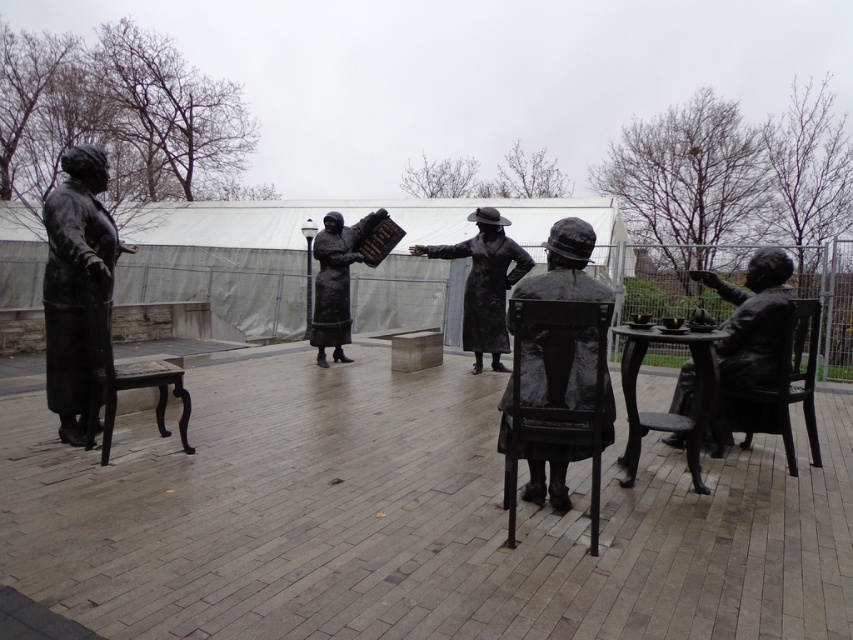
You are a photographer trying to capture both the shiny black coat at center and the bronze statue of woman holding book at center in the same frame. Based on their positions, which object should you adjust your camera angle to focus on first to include both?

The shiny black coat at center is positioned on the right side of bronze statue of woman holding book at center. To include both in the frame, you should first focus on the bronze statue of woman holding book at center and then adjust the angle to include the shiny black coat at center on its right side.

You are a visitor at the park and want to sit on one of the chairs. The black metal chair at center is lower than the black polished wood chair at left. Which chair would you choose if you prefer a seat that is closer to the ground?

The black metal chair at center is not as tall as the black polished wood chair at left, so if you prefer a seat closer to the ground, you should choose the black metal chair at center.

You are a tour guide leading a group through the park. You want to point out both the shiny black coat at center and the bronze statue of woman holding book at center to your group. Can you fit both into your field of view without moving your head? Explain why or why not.

The shiny black coat at center is only 1.29 meters away from the bronze statue of woman holding book at center. Since they are so close to each other, you can easily fit both into your field of view without moving your head.